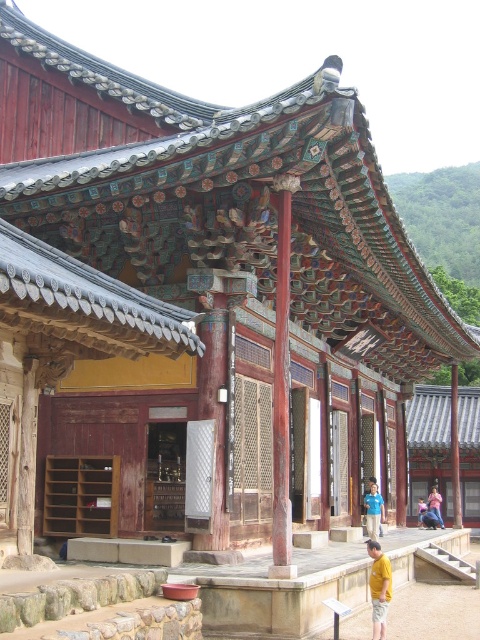
Does blue fabric shirt at center have a larger size compared to light blue shirt at center?

Incorrect, blue fabric shirt at center is not larger than light blue shirt at center.

Where is `blue fabric shirt at center`? The width and height of the screenshot is (480, 640). blue fabric shirt at center is located at coordinates (373, 509).

Does wooden at center appear on the right side of light blue shirt at center?

Incorrect, wooden at center is not on the right side of light blue shirt at center.

Does wooden at center have a lesser width compared to light blue shirt at center?

Yes.

The width and height of the screenshot is (480, 640). I want to click on wooden at center, so click(x=282, y=387).

What are the coordinates of `wooden at center` in the screenshot? It's located at (282, 387).

Is the position of yellow cotton shirt at lower right more distant than that of pink fabric person at center?

No, it is in front of pink fabric person at center.

Is yellow cotton shirt at lower right taller than pink fabric person at center?

Yes, yellow cotton shirt at lower right is taller than pink fabric person at center.

Which is behind, point (391, 586) or point (434, 499)?

The point (434, 499) is behind.

In order to click on yellow cotton shirt at lower right in this screenshot , I will do `click(379, 588)`.